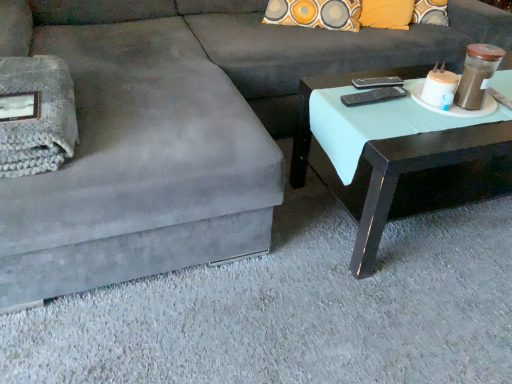
Find the location of a particular element. The image size is (512, 384). free point in front of black plastic remote at upper right, the 2th remote viewed from the back is located at coordinates (396, 122).